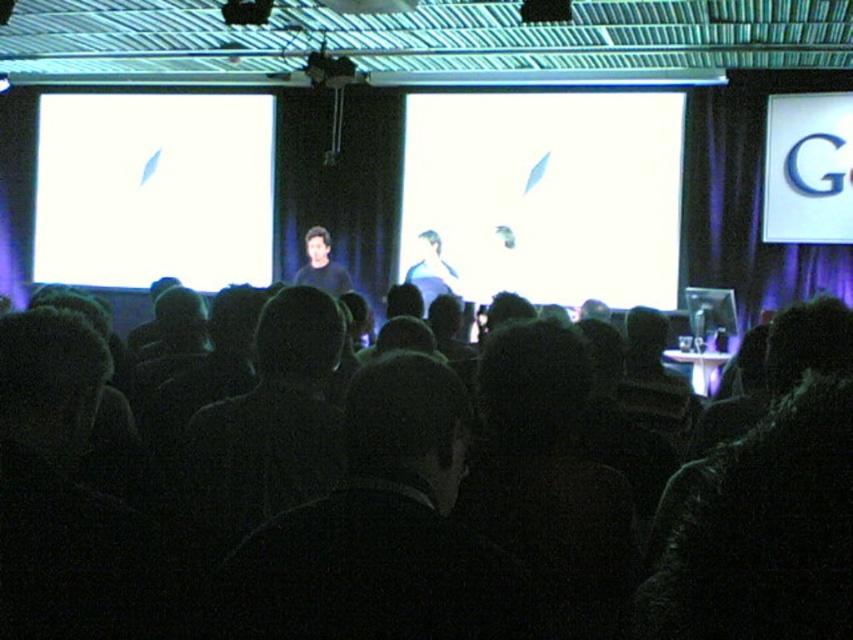
Can you confirm if white paper at upper right is wider than black plastic projector at upper center?

Yes, white paper at upper right is wider than black plastic projector at upper center.

Find the location of a particular element. Image resolution: width=853 pixels, height=640 pixels. white paper at upper right is located at coordinates (807, 170).

Which is above, white matte projection screen at center or white paper at upper right?

white paper at upper right is above.

Does white matte projection screen at center have a larger size compared to white paper at upper right?

Yes, white matte projection screen at center is bigger than white paper at upper right.

Is point (631, 240) positioned behind point (780, 228)?

Yes.

The width and height of the screenshot is (853, 640). I want to click on white matte projection screen at center, so coord(547,193).

Can you confirm if white matte projection screen at center is positioned below black matte speaker at center?

Yes, white matte projection screen at center is below black matte speaker at center.

Locate an element on the screen. This screenshot has width=853, height=640. white matte projection screen at center is located at coordinates (547, 193).